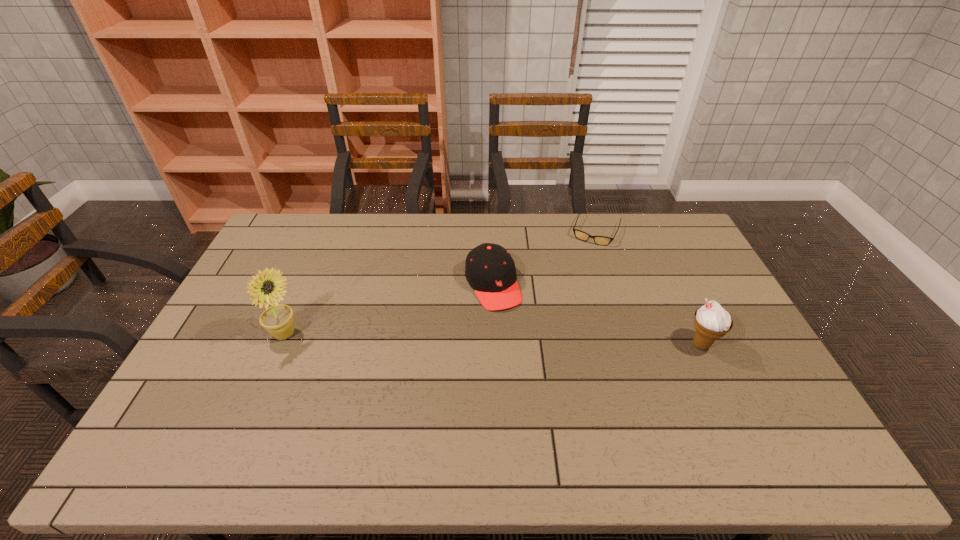
The width and height of the screenshot is (960, 540). I want to click on vacant space at the left edge, so click(245, 322).

Image resolution: width=960 pixels, height=540 pixels. In order to click on vacant space at the right edge of the desktop in this screenshot , I will do `click(744, 370)`.

At what (x,y) coordinates should I click in order to perform the action: click on free spot between the sunflower and the third shortest object. Please return your answer as a coordinate pair (x, y). Looking at the image, I should click on (492, 340).

At what (x,y) coordinates should I click in order to perform the action: click on free space between the second object from left to right and the shortest object. Please return your answer as a coordinate pair (x, y). Looking at the image, I should click on click(544, 258).

Where is `blank region between the second tallest object and the sunglasses`? The height and width of the screenshot is (540, 960). blank region between the second tallest object and the sunglasses is located at coordinates (649, 287).

This screenshot has width=960, height=540. Identify the location of empty space that is in between the rightmost object and the third object from right to left. (597, 315).

Identify the location of blank region between the shortest object and the third shortest object. This screenshot has height=540, width=960. (649, 287).

Find the location of a particular element. unoccupied position between the shortest object and the tallest object is located at coordinates (441, 282).

Locate an element on the screen. The width and height of the screenshot is (960, 540). free spot between the sunflower and the third nearest object is located at coordinates (389, 310).

In order to click on free space between the rightmost object and the leftmost object in this screenshot , I will do `click(492, 340)`.